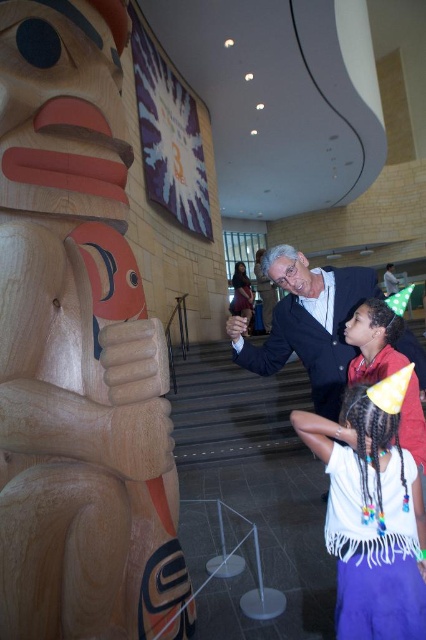
You are organizing a fashion show and need to decide which outfit takes up more space. Based on the scene, which is wider, the white fringed shirt at lower center or the smooth navy suit at center?

The smooth navy suit at center is wider than the white fringed shirt at lower center.

You are standing in the room and want to touch the natural wood totem pole at left. Based on the coordinates provided, is the point at [77,348] on the natural wood totem pole at left?

Yes, the point at [77,348] corresponds to the natural wood totem pole at left, so touching that coordinate would reach the totem pole.

You are standing in the room and want to take a photo of the natural wood totem pole at left. Where should you position yourself to capture it in the frame?

To capture the natural wood totem pole at left in the frame, position yourself so that the center of your camera is at approximately point coordinates of 0.544 on the x axis and 0.183 on the y axis, as this is where the totem pole is located.